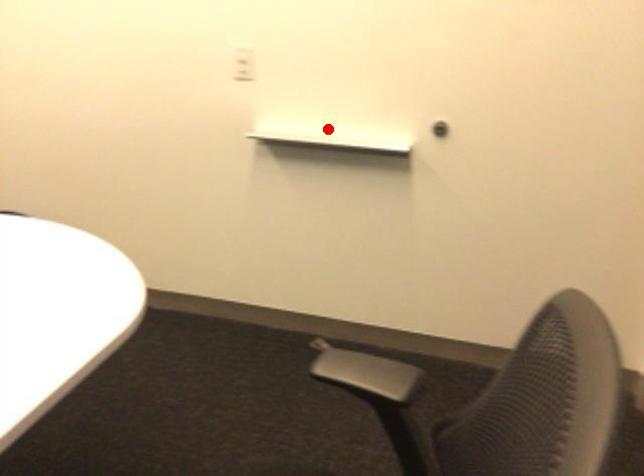
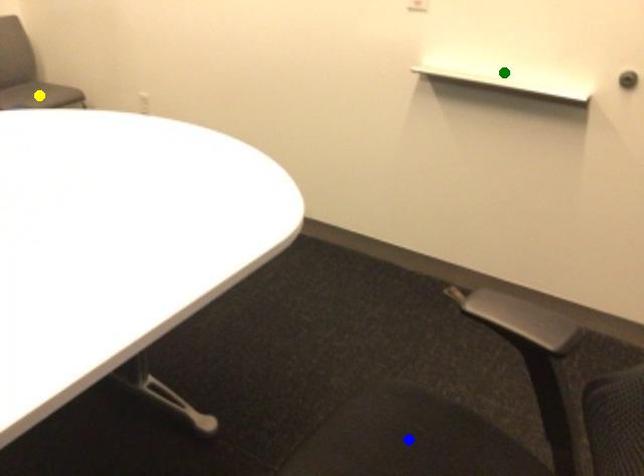
Question: I am providing you with two images of the same scene from different viewpoints. A red point is marked on the first image. You are given multiple points on the second image. Can you choose the point in image 2 that corresponds to the point in image 1?

Choices:
 (A) green point
 (B) blue point
 (C) yellow point

Answer: (A)